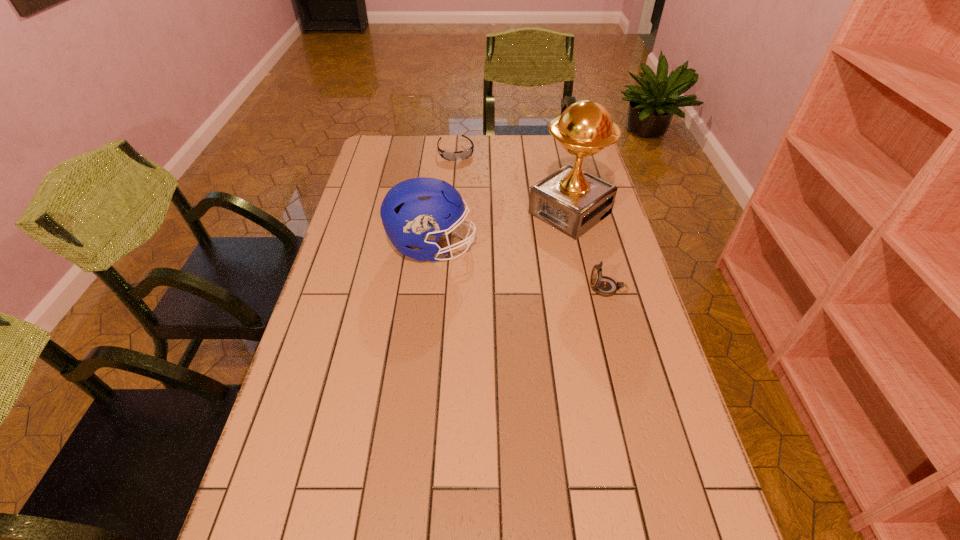
What are the coordinates of `free space between the second shortest object and the football helmet` in the screenshot? It's located at (520, 268).

Image resolution: width=960 pixels, height=540 pixels. I want to click on free space that is in between the third tallest object and the third shortest object, so click(x=520, y=268).

What are the coordinates of `unoccupied position between the award and the farthest object` in the screenshot? It's located at [x=513, y=183].

You are a GUI agent. You are given a task and a screenshot of the screen. Output one action in this format:
    pyautogui.click(x=<x>, y=<y>)
    Task: Click on the empty location between the farthest object and the tallest object
    
    Given the screenshot: What is the action you would take?
    pyautogui.click(x=513, y=183)

Select which object is the closest to the second shortest object. Please provide its 2D coordinates. Your answer should be formatted as a tuple, i.e. [(x, y)], where the tuple contains the x and y coordinates of a point satisfying the conditions above.

[(571, 200)]

Locate which object ranks third in proximity to the second shortest object. Please provide its 2D coordinates. Your answer should be formatted as a tuple, i.e. [(x, y)], where the tuple contains the x and y coordinates of a point satisfying the conditions above.

[(450, 156)]

Where is `blank area in the image that satisfies the following two spatial constraints: 1. on the front side of the award; 2. on the left side of the shortest object`? blank area in the image that satisfies the following two spatial constraints: 1. on the front side of the award; 2. on the left side of the shortest object is located at coordinates (451, 213).

Where is `vacant space that satisfies the following two spatial constraints: 1. on the front side of the nearest object; 2. on the face of the award`? The image size is (960, 540). vacant space that satisfies the following two spatial constraints: 1. on the front side of the nearest object; 2. on the face of the award is located at coordinates (587, 288).

Locate an element on the screen. Image resolution: width=960 pixels, height=540 pixels. free spot that satisfies the following two spatial constraints: 1. on the front side of the nearest object; 2. on the face of the shortest object is located at coordinates (446, 288).